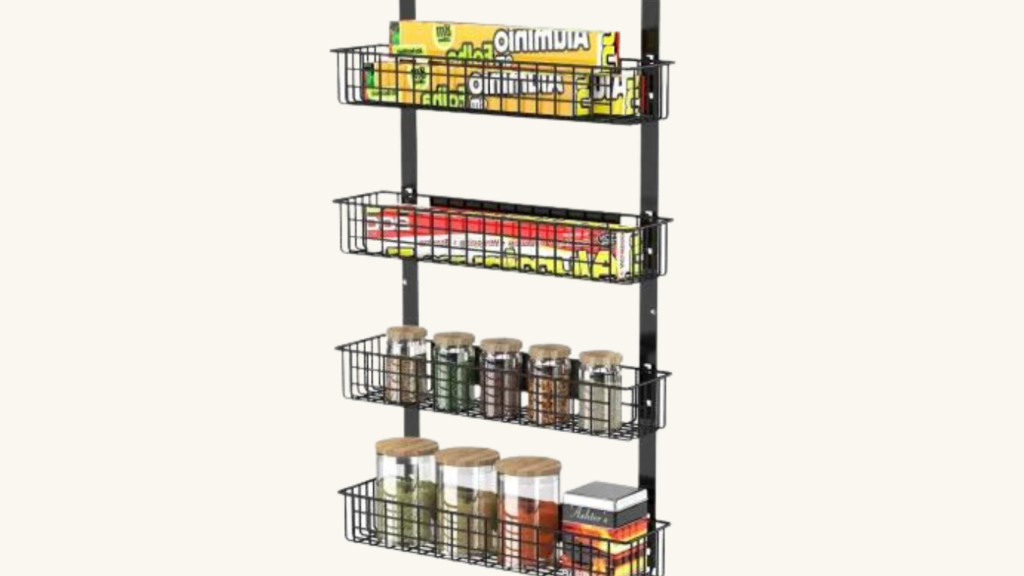
Image resolution: width=1024 pixels, height=576 pixels. I want to click on small jars of spices, so click(x=397, y=350), click(x=447, y=352), click(x=495, y=361), click(x=546, y=369), click(x=590, y=374).